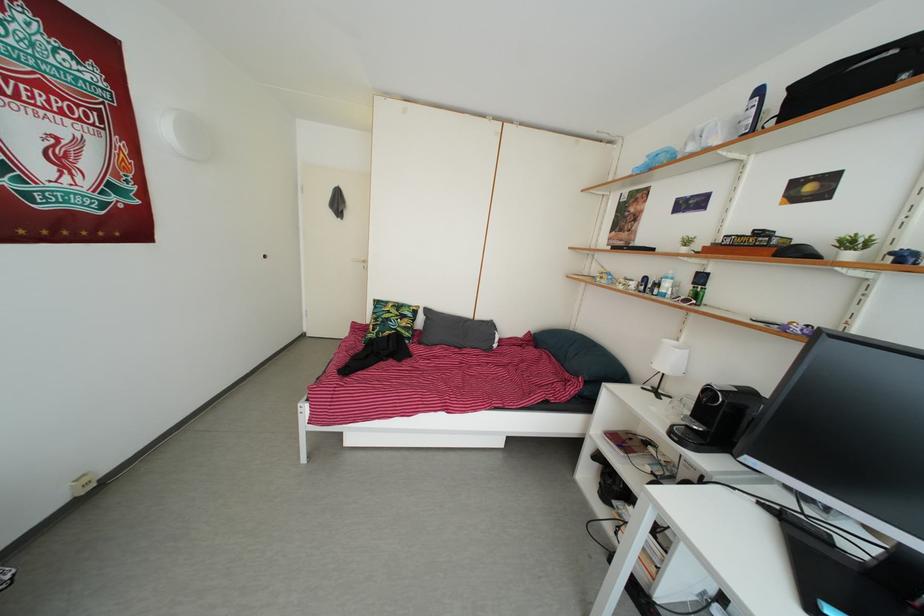
Find where to lift the coffee machine lever. Please return your answer as a coordinate pair (x, y).

(740, 419)